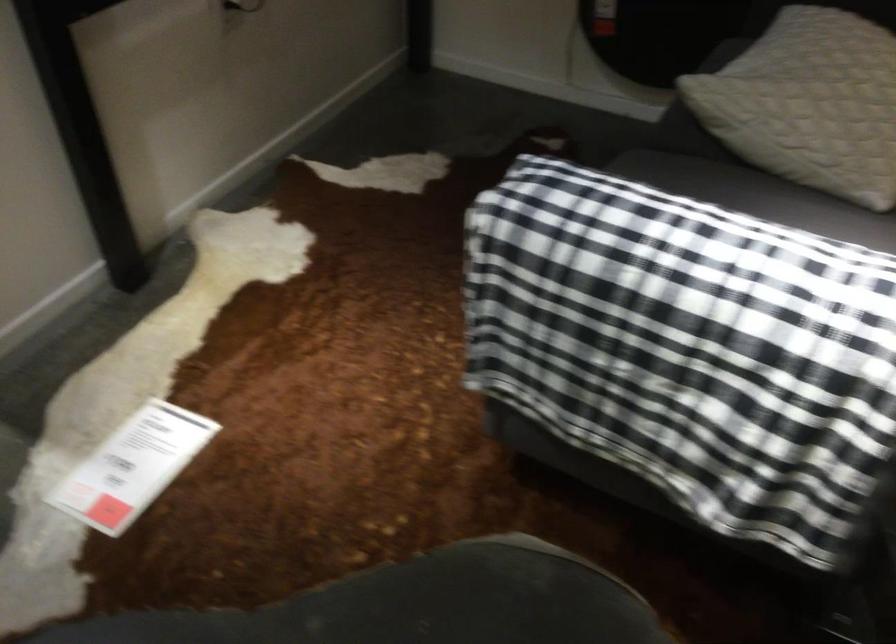
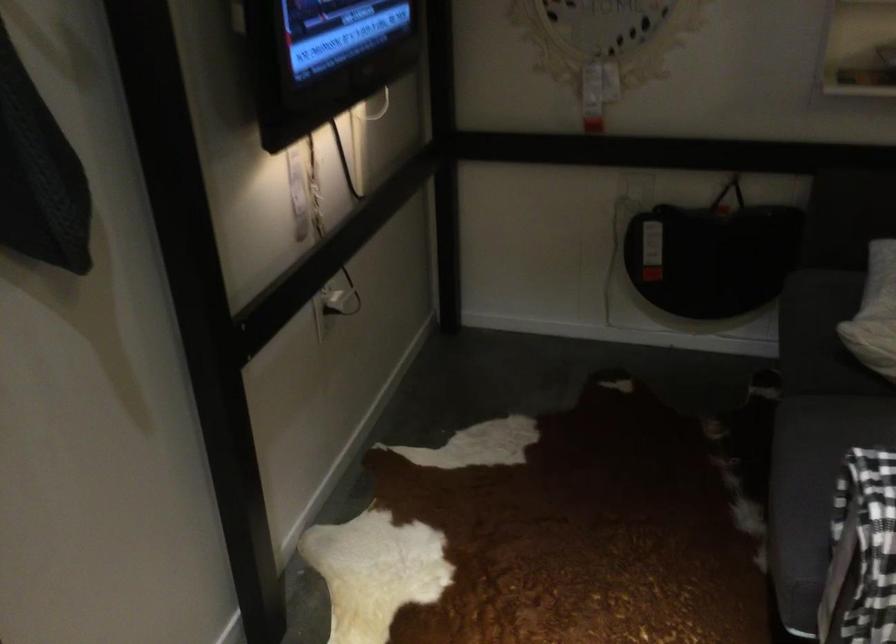
Question: The first image is from the beginning of the video and the second image is from the end. How did the camera likely rotate when shooting the video?

Choices:
 (A) Left
 (B) Right
 (C) Up
 (D) Down

Answer: (C)